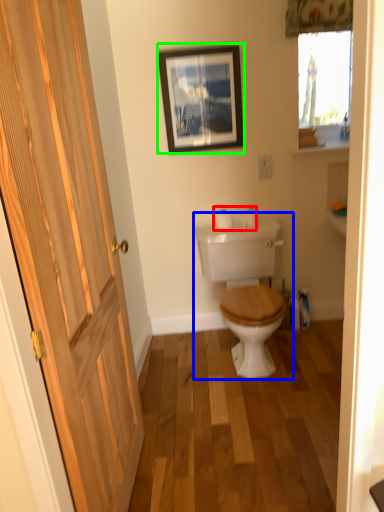
Question: Estimate the real-world distances between objects in this image. Which object is closer to toilet paper (highlighted by a red box), toilet (highlighted by a blue box) or picture frame (highlighted by a green box)?

Choices:
 (A) toilet
 (B) picture frame

Answer: (A)